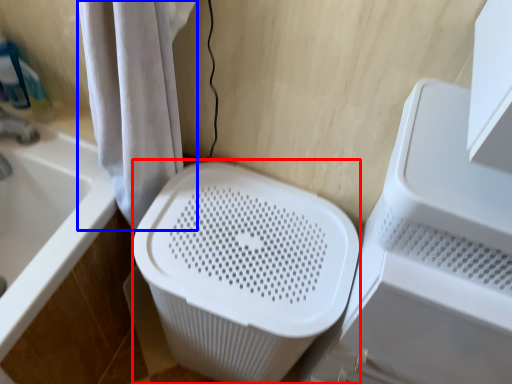
Question: Which object appears closest to the camera in this image, laundry basket (highlighted by a red box) or shower curtain (highlighted by a blue box)?

Choices:
 (A) laundry basket
 (B) shower curtain

Answer: (B)